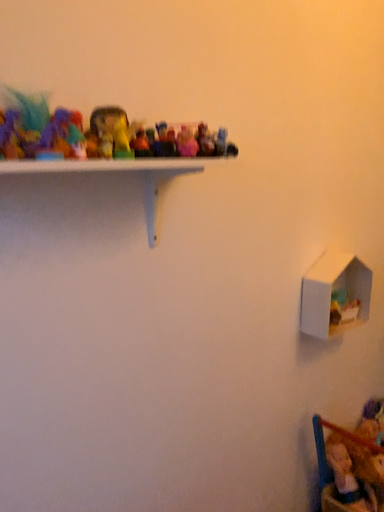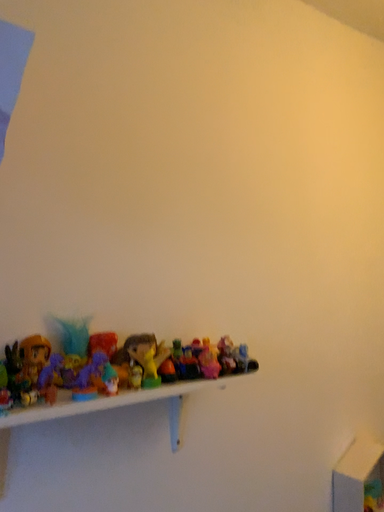
Question: How did the camera likely rotate when shooting the video?

Choices:
 (A) rotated upward
 (B) rotated downward

Answer: (A)